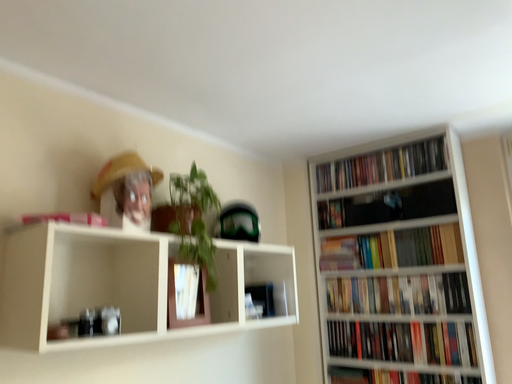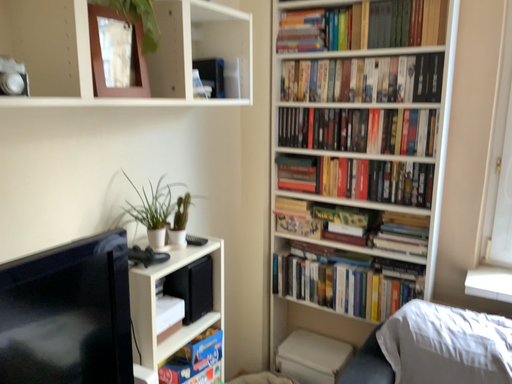
Question: How did the camera likely rotate when shooting the video?

Choices:
 (A) rotated upward
 (B) rotated downward

Answer: (B)